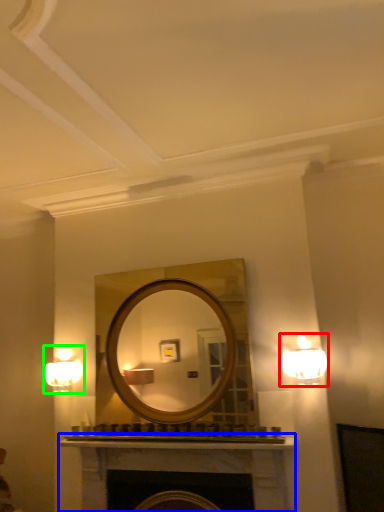
Question: Which object is the farthest from lamp (highlighted by a red box)? Choose among these: fireplace (highlighted by a blue box) or fixture (highlighted by a green box).

Choices:
 (A) fireplace
 (B) fixture

Answer: (B)